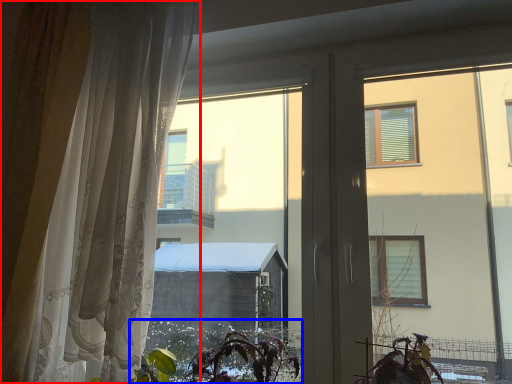
Question: Which point is further to the camera, curtain (highlighted by a red box) or vegetation (highlighted by a blue box)?

Choices:
 (A) curtain
 (B) vegetation

Answer: (B)